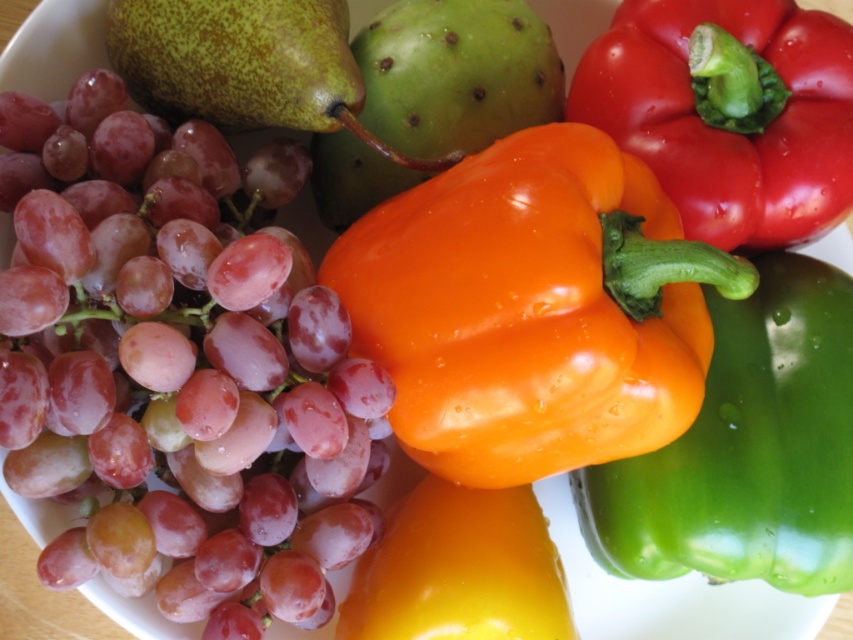
Question: Can you confirm if shiny orange bell pepper at center is positioned to the left of green glossy bell pepper at center?

Choices:
 (A) no
 (B) yes

Answer: (B)

Question: Can you confirm if green glossy bell pepper at center is positioned above shiny red bell pepper at upper right?

Choices:
 (A) yes
 (B) no

Answer: (B)

Question: Which object is closer to the camera taking this photo?

Choices:
 (A) green glossy bell pepper at center
 (B) shiny orange bell pepper at center

Answer: (B)

Question: Which point appears farthest from the camera in this image?

Choices:
 (A) [631, 209]
 (B) [828, 45]
 (C) [790, 524]
 (D) [71, 385]

Answer: (B)

Question: Is green glossy bell pepper at center further to the viewer compared to shiny red bell pepper at upper right?

Choices:
 (A) no
 (B) yes

Answer: (A)

Question: Which point appears closest to the camera in this image?

Choices:
 (A) (579, 177)
 (B) (144, 268)
 (C) (715, 477)

Answer: (B)